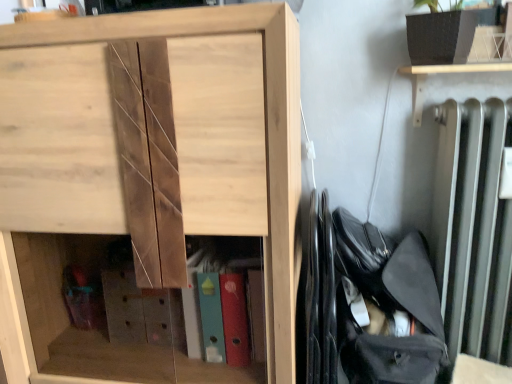
Locate an element on the screen. The height and width of the screenshot is (384, 512). natural wood cabinet at center is located at coordinates click(x=267, y=128).

Describe the element at coordinates (267, 128) in the screenshot. This screenshot has width=512, height=384. I see `natural wood cabinet at center` at that location.

What do you see at coordinates (370, 300) in the screenshot?
I see `black fabric bag at right` at bounding box center [370, 300].

What are the coordinates of `black fabric bag at right` in the screenshot? It's located at (370, 300).

Identify the location of natural wood cabinet at center. The image size is (512, 384). (267, 128).

Based on their positions, is natural wood cabinet at center located to the left or right of black fabric bag at right?

In the image, natural wood cabinet at center appears on the left side of black fabric bag at right.

Is natural wood cabinet at center further to camera compared to black fabric bag at right?

That is False.

Is point (283, 264) less distant than point (316, 245)?

Yes.

From the image's perspective, which is below, natural wood cabinet at center or black fabric bag at right?

black fabric bag at right is shown below in the image.

From a real-world perspective, who is located higher, natural wood cabinet at center or black fabric bag at right?

From a 3D spatial view, natural wood cabinet at center is above.

Which object is wider, natural wood cabinet at center or black fabric bag at right?

With larger width is natural wood cabinet at center.

Does natural wood cabinet at center have a greater height compared to black fabric bag at right?

Indeed, natural wood cabinet at center has a greater height compared to black fabric bag at right.

Consider the image. Does natural wood cabinet at center have a smaller size compared to black fabric bag at right?

No.

Is natural wood cabinet at center positioned beyond the bounds of black fabric bag at right?

Yes, natural wood cabinet at center is located beyond the bounds of black fabric bag at right.

Is natural wood cabinet at center touching black fabric bag at right?

natural wood cabinet at center and black fabric bag at right are not in contact.

Is natural wood cabinet at center facing away from black fabric bag at right?

natural wood cabinet at center does not have its back to black fabric bag at right.

Looking at this image, measure the distance from natural wood cabinet at center to black fabric bag at right.

27.38 centimeters.

Find the location of a particular element. Image resolution: width=512 pixels, height=384 pixels. cupboard on the left of black fabric bag at right is located at coordinates (267, 128).

Is black fabric bag at right to the left of natural wood cabinet at center from the viewer's perspective?

No.

Does black fabric bag at right lie in front of natural wood cabinet at center?

No, it is not.

Considering the points (342, 352) and (300, 190), which point is behind, point (342, 352) or point (300, 190)?

Positioned behind is point (300, 190).

From the image's perspective, is black fabric bag at right located above natural wood cabinet at center?

No, from the image's perspective, black fabric bag at right is not above natural wood cabinet at center.

From a real-world perspective, is black fabric bag at right physically above natural wood cabinet at center?

Actually, black fabric bag at right is physically below natural wood cabinet at center in the real world.

Does black fabric bag at right have a lesser width compared to natural wood cabinet at center?

Indeed, black fabric bag at right has a lesser width compared to natural wood cabinet at center.

Considering the sizes of black fabric bag at right and natural wood cabinet at center in the image, is black fabric bag at right taller or shorter than natural wood cabinet at center?

black fabric bag at right is shorter than natural wood cabinet at center.

Is black fabric bag at right bigger than natural wood cabinet at center?

Actually, black fabric bag at right might be smaller than natural wood cabinet at center.

Does black fabric bag at right contain natural wood cabinet at center?

That's incorrect, natural wood cabinet at center is not inside black fabric bag at right.

Are black fabric bag at right and natural wood cabinet at center located far from each other?

No, black fabric bag at right is in close proximity to natural wood cabinet at center.

Is black fabric bag at right oriented away from natural wood cabinet at center?

No, black fabric bag at right is not facing away from natural wood cabinet at center.

Locate an element on the screen. cupboard in front of the black fabric bag at right is located at coordinates (267, 128).

Where is `cupboard in front of the black fabric bag at right`? cupboard in front of the black fabric bag at right is located at coordinates (267, 128).

Where is `bag that appears behind the natural wood cabinet at center`? bag that appears behind the natural wood cabinet at center is located at coordinates (370, 300).